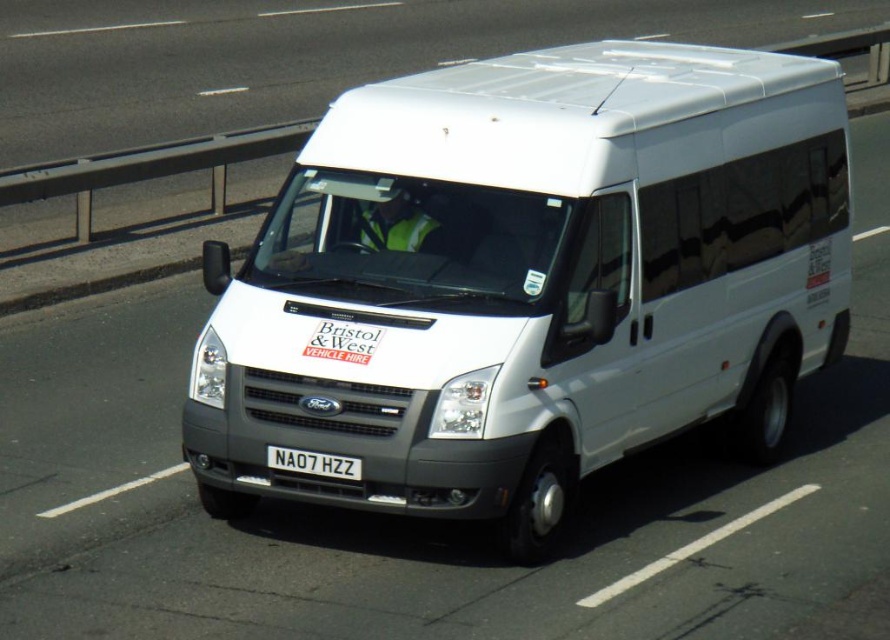
Between point (488, 468) and point (289, 461), which one is positioned behind?

The point (289, 461) is more distant.

Does white matte van at center appear under white plastic license plate at center?

No.

Which is behind, point (441, 403) or point (312, 460)?

The point (312, 460) is behind.

This screenshot has width=890, height=640. In order to click on white matte van at center in this screenshot , I will do `click(530, 280)`.